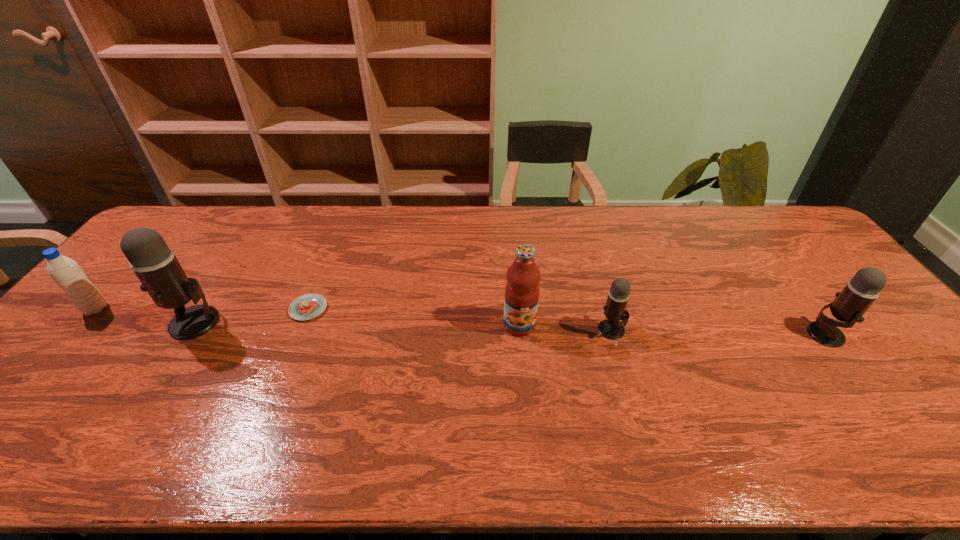
This screenshot has height=540, width=960. I want to click on the tallest microphone, so click(x=154, y=263).

Locate an element on the screen. Image resolution: width=960 pixels, height=540 pixels. the tallest object is located at coordinates (154, 263).

At what (x,y) coordinates should I click in order to perform the action: click on the second microphone from left to right. Please return your answer as a coordinate pair (x, y). The height and width of the screenshot is (540, 960). Looking at the image, I should click on (611, 328).

Locate an element on the screen. This screenshot has width=960, height=540. the second object from right to left is located at coordinates (611, 328).

This screenshot has width=960, height=540. I want to click on the rightmost microphone, so click(x=850, y=304).

What are the coordinates of `the rightmost object` in the screenshot? It's located at (850, 304).

Identify the location of the third object from left to right. (309, 306).

The image size is (960, 540). What are the coordinates of `pastry` in the screenshot? It's located at (309, 306).

The width and height of the screenshot is (960, 540). I want to click on fruit juice, so click(523, 276).

You are a GUI agent. You are given a task and a screenshot of the screen. Output one action in this format:
    pyautogui.click(x=<x>, y=<y>)
    Task: Click on the water bottle
    
    Given the screenshot: What is the action you would take?
    pyautogui.click(x=67, y=274)